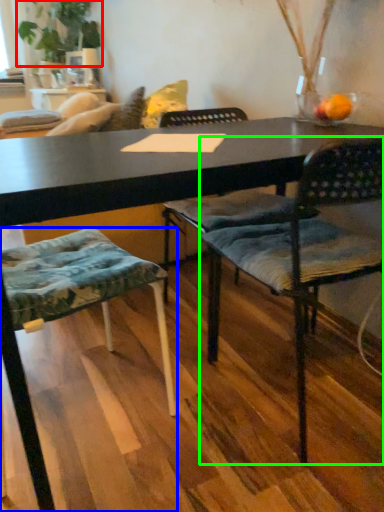
Question: Which is farther away from plant (highlighted by a red box)? chair (highlighted by a blue box) or chair (highlighted by a green box)?

Choices:
 (A) chair
 (B) chair

Answer: (B)